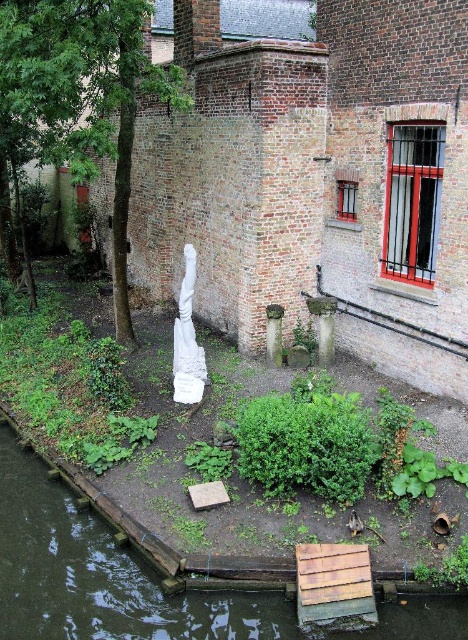
Looking at this image, can you confirm if clear water at dock lower left is positioned to the left of green leafy tree at center-left?

No, clear water at dock lower left is not to the left of green leafy tree at center-left.

Who is taller, clear water at dock lower left or green leafy tree at center-left?

With more height is green leafy tree at center-left.

Which is behind, point (181, 627) or point (114, 141)?

Point (114, 141)

The image size is (468, 640). Identify the location of clear water at dock lower left. (99, 576).

Does wooden planks at lower center appear over white marble column at center?

Incorrect, wooden planks at lower center is not positioned above white marble column at center.

Who is more distant from viewer, (342, 566) or (199, 385)?

Positioned behind is point (199, 385).

Is point (306, 608) behind point (188, 385)?

No, (306, 608) is closer to viewer.

Locate an element on the screen. The width and height of the screenshot is (468, 640). wooden planks at lower center is located at coordinates (335, 586).

What are the coordinates of `green leafy tree at center-left` in the screenshot? It's located at [x=83, y=92].

Which is above, green leafy tree at center-left or white marble column at center?

Positioned higher is green leafy tree at center-left.

Describe the element at coordinates (83, 92) in the screenshot. I see `green leafy tree at center-left` at that location.

Identify the location of green leafy tree at center-left. (83, 92).